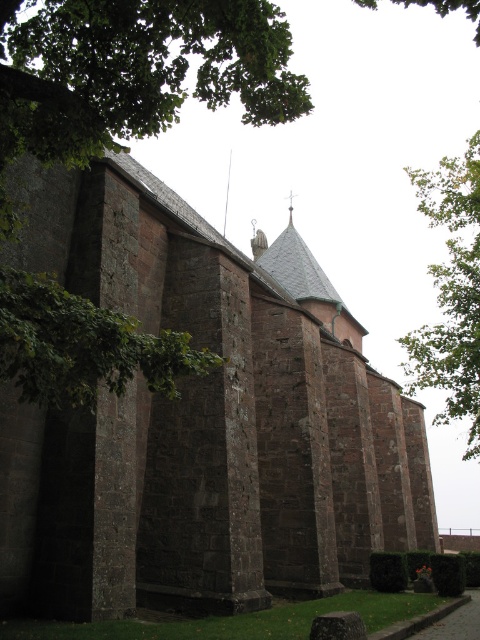
You are standing in front of the historic stone church and notice two points marked on the image. The first point is at coordinate point (107, 134) and the second is at point (468, 442). Which point is nearer to your current position?

Point (107, 134) is closer to the camera than point (468, 442), so the first point is nearer to your current position.

You are standing on the lawn in front of the brown stone church at center and want to walk to the green leafy tree at upper right. Which direction should you head towards?

The brown stone church at center is positioned on the left side of the green leafy tree at upper right, so you should head towards the right direction to reach the green leafy tree at upper right.